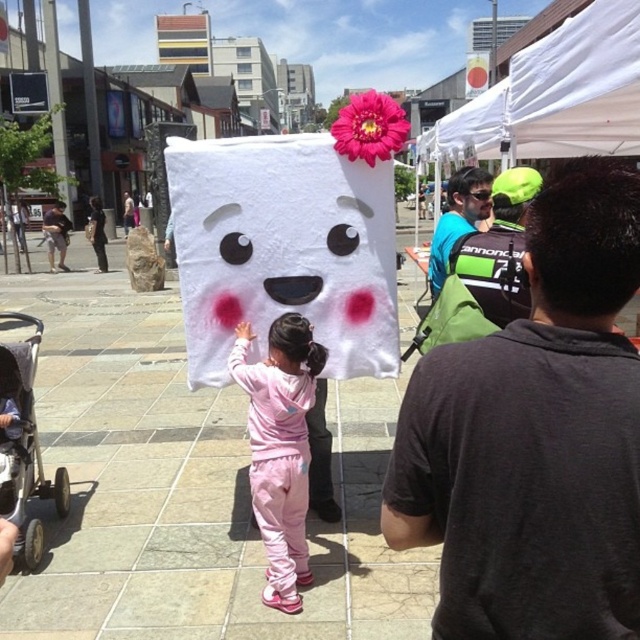
Can you confirm if gray fabric stroller at lower left is wider than blue fabric shirt at upper right?

Correct, the width of gray fabric stroller at lower left exceeds that of blue fabric shirt at upper right.

Is gray fabric stroller at lower left to the right of blue fabric shirt at upper right from the viewer's perspective?

No, gray fabric stroller at lower left is not to the right of blue fabric shirt at upper right.

The width and height of the screenshot is (640, 640). Identify the location of gray fabric stroller at lower left. (26, 445).

Can you confirm if blue fabric shirt at upper right is thinner than matte black sunglasses at upper center?

No.

Does point (456, 196) lie in front of point (465, 196)?

No, (456, 196) is behind (465, 196).

This screenshot has width=640, height=640. Find the location of `blue fabric shirt at upper right`. blue fabric shirt at upper right is located at coordinates (458, 220).

Does white fabric canopy at upper center have a smaller size compared to matte black sunglasses at upper center?

No.

Who is positioned more to the left, white fabric canopy at upper center or matte black sunglasses at upper center?

matte black sunglasses at upper center is more to the left.

This screenshot has height=640, width=640. Find the location of `white fabric canopy at upper center`. white fabric canopy at upper center is located at coordinates (556, 96).